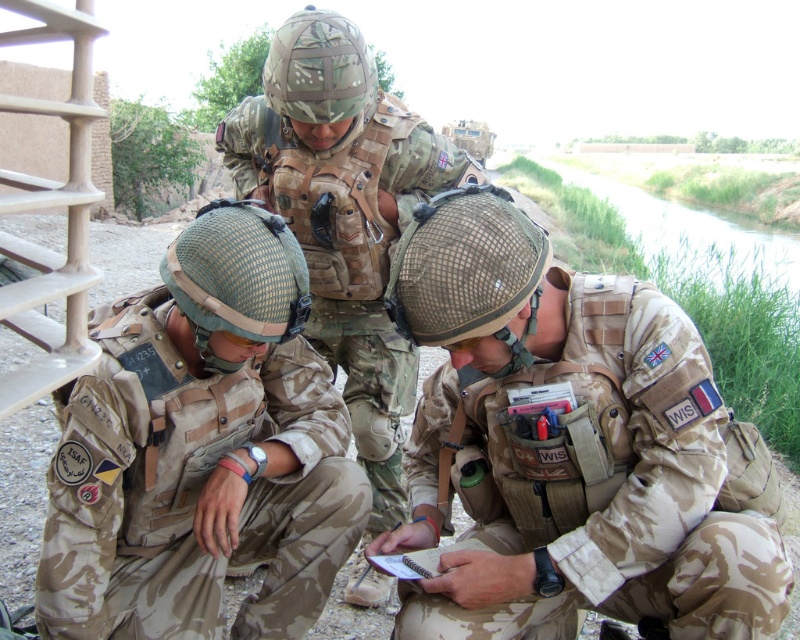
You are a military medic who needs to locate the camouflage fabric uniform at lower left and the camo fabric helmet at center for a medical checkup. According to the scene, which object is positioned to the left of the other?

The camouflage fabric uniform at lower left is to the left of camo fabric helmet at center.

Consider the image. Based on the coordinates provided, which object is located at point (566,448)?

The point (566,448) marks the camouflage fabric uniform at lower right.